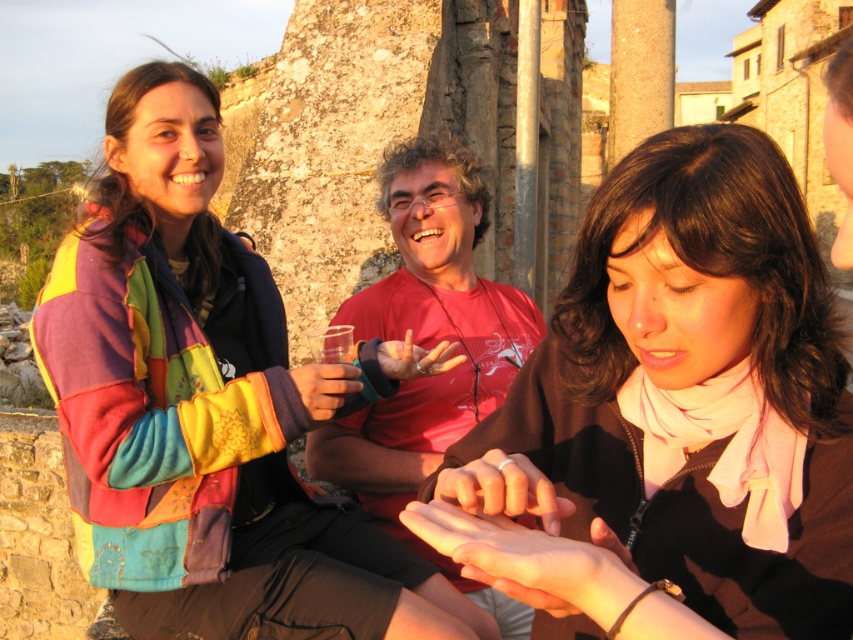
Which of these two, multicolored fleece jacket at upper left or brown matte scarf at center, stands shorter?

brown matte scarf at center

Between multicolored fleece jacket at upper left and brown matte scarf at center, which one appears on the left side from the viewer's perspective?

From the viewer's perspective, multicolored fleece jacket at upper left appears more on the left side.

Between point (302, 566) and point (799, 410), which one is positioned in front?

Point (799, 410)

Locate an element on the screen. multicolored fleece jacket at upper left is located at coordinates (212, 406).